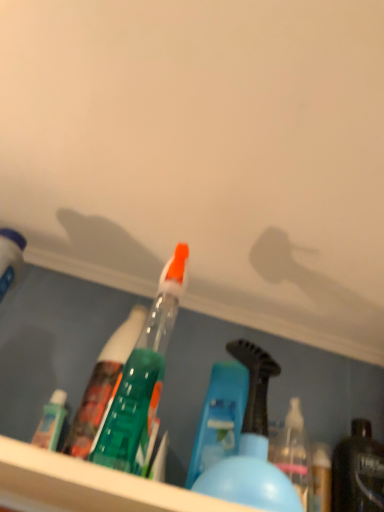
Question: Should I look upward or downward to see blue plastic bottle at center, which is the second bottle in left-to-right order?

Choices:
 (A) down
 (B) up

Answer: (A)

Question: Is shiny black bottle at lower right, the 3th bottle from the left, further to camera compared to matte white bottle at left, positioned as the 3th bottle in right-to-left order?

Choices:
 (A) yes
 (B) no

Answer: (A)

Question: Considering the relative sizes of shiny black bottle at lower right, the 3th bottle from the left, and matte white bottle at left, the 1th bottle from the left, in the image provided, is shiny black bottle at lower right, the 3th bottle from the left, taller than matte white bottle at left, the 1th bottle from the left,?

Choices:
 (A) no
 (B) yes

Answer: (A)

Question: From a real-world perspective, is shiny black bottle at lower right, the first bottle in the right-to-left sequence, located beneath matte white bottle at left, the 1th bottle from the left?

Choices:
 (A) yes
 (B) no

Answer: (A)

Question: Can you confirm if shiny black bottle at lower right, the first bottle in the right-to-left sequence, is smaller than matte white bottle at left, the 1th bottle from the left?

Choices:
 (A) no
 (B) yes

Answer: (B)

Question: Considering the relative sizes of shiny black bottle at lower right, the 3th bottle from the left, and matte white bottle at left, the 1th bottle from the left, in the image provided, is shiny black bottle at lower right, the 3th bottle from the left, wider than matte white bottle at left, the 1th bottle from the left,?

Choices:
 (A) yes
 (B) no

Answer: (B)

Question: Does shiny black bottle at lower right, the 3th bottle from the left, appear on the left side of matte white bottle at left, positioned as the 3th bottle in right-to-left order?

Choices:
 (A) yes
 (B) no

Answer: (B)

Question: Is shiny black bottle at lower right, the first bottle in the right-to-left sequence, directly adjacent to blue plastic bottle at center, the 2th bottle from the right?

Choices:
 (A) no
 (B) yes

Answer: (A)

Question: Does shiny black bottle at lower right, the first bottle in the right-to-left sequence, turn towards blue plastic bottle at center, which is the second bottle in left-to-right order?

Choices:
 (A) no
 (B) yes

Answer: (A)

Question: Is shiny black bottle at lower right, the first bottle in the right-to-left sequence, bigger than blue plastic bottle at center, which is the second bottle in left-to-right order?

Choices:
 (A) yes
 (B) no

Answer: (B)

Question: From a real-world perspective, is shiny black bottle at lower right, the 3th bottle from the left, located higher than blue plastic bottle at center, which is the second bottle in left-to-right order?

Choices:
 (A) yes
 (B) no

Answer: (A)

Question: From a real-world perspective, is shiny black bottle at lower right, the 3th bottle from the left, located beneath blue plastic bottle at center, which is the second bottle in left-to-right order?

Choices:
 (A) no
 (B) yes

Answer: (A)

Question: Is the depth of shiny black bottle at lower right, the 3th bottle from the left, greater than that of blue plastic bottle at center, the 2th bottle from the right?

Choices:
 (A) no
 (B) yes

Answer: (B)

Question: From the image's perspective, does blue plastic bottle at center, which is the second bottle in left-to-right order, appear higher than matte white bottle at left, the 1th bottle from the left?

Choices:
 (A) yes
 (B) no

Answer: (B)